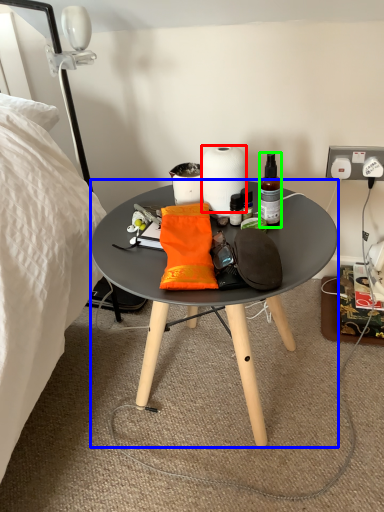
Question: Considering the real-world distances, which object is closest to paper towel (highlighted by a red box)? coffee table (highlighted by a blue box) or bottle (highlighted by a green box).

Choices:
 (A) coffee table
 (B) bottle

Answer: (B)